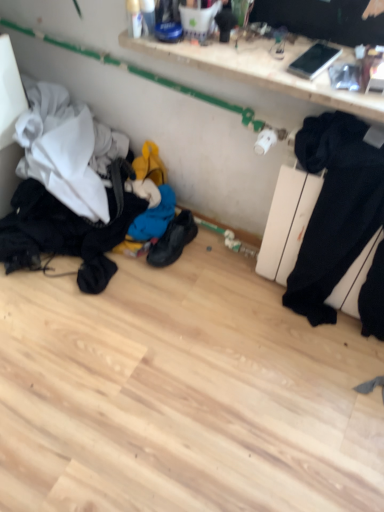
The width and height of the screenshot is (384, 512). I want to click on free point above white glossy shelf at upper center (from a real-world perspective), so click(273, 50).